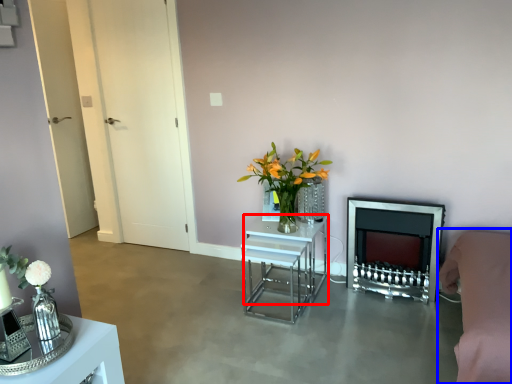
Question: Which object is further to the camera taking this photo, table (highlighted by a red box) or couch (highlighted by a blue box)?

Choices:
 (A) table
 (B) couch

Answer: (A)